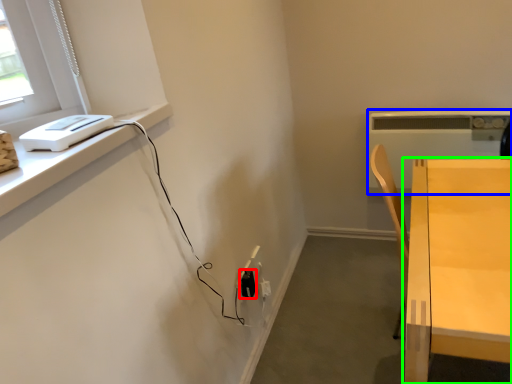
Question: Which object is positioned farthest from electric outlet (highlighted by a red box)? Select from appliance (highlighted by a blue box) and table (highlighted by a green box).

Choices:
 (A) appliance
 (B) table

Answer: (A)